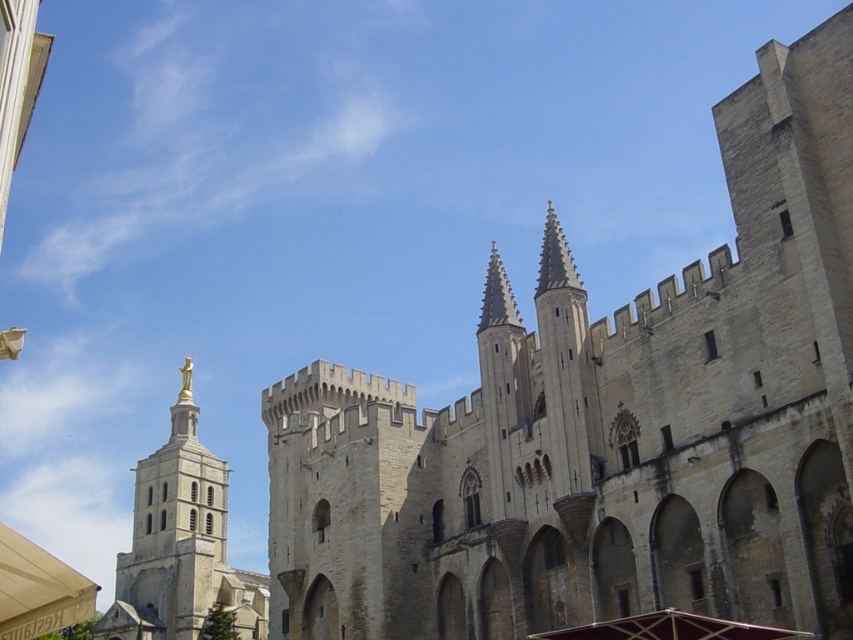
You are an architect planning to place a decorative flagpole between the beige stone castle at center and the gold statue at center. Since the flagpole needs to be placed closer to the wider structure, which structure should the flagpole be placed near?

The beige stone castle at center is wider than the gold statue at center, so the flagpole should be placed closer to the beige stone castle at center.